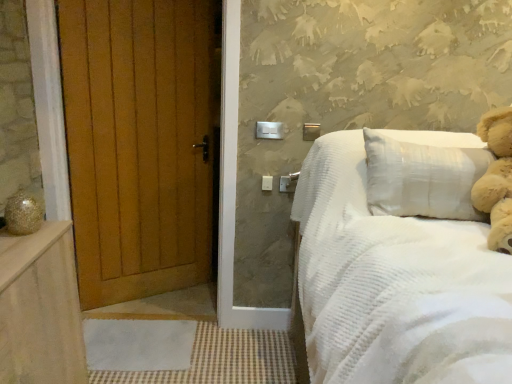
Identify the location of wooden balustrade at lower left. (40, 309).

The image size is (512, 384). I want to click on white corduroy bed at right, so click(394, 284).

Identify the location of wooden door at left. (139, 142).

From the image's perspective, is wooden door at left above or below white corduroy bed at right?

Based on their image positions, wooden door at left is located above white corduroy bed at right.

In the image, is wooden door at left positioned in front of or behind white corduroy bed at right?

In the image, wooden door at left appears behind white corduroy bed at right.

Based on the photo, considering the sizes of objects wooden door at left and white corduroy bed at right in the image provided, who is thinner, wooden door at left or white corduroy bed at right?

wooden door at left.

Are wooden door at left and white corduroy bed at right making contact?

wooden door at left and white corduroy bed at right are not in contact.

Considering the positions of objects white corduroy bed at right and fluffy beige teddy bear at upper right in the image provided, who is behind, white corduroy bed at right or fluffy beige teddy bear at upper right?

fluffy beige teddy bear at upper right is more distant.

Considering the points (332, 372) and (503, 123), which point is in front, point (332, 372) or point (503, 123)?

Point (332, 372)

From a real-world perspective, is white corduroy bed at right physically below fluffy beige teddy bear at upper right?

Yes.

From the image's perspective, between fluffy beige teddy bear at upper right and wooden door at left, who is located below?

wooden door at left.

Find the location of `teddy above the wooden door at left (from a real-world perspective)`. teddy above the wooden door at left (from a real-world perspective) is located at coordinates (496, 178).

Is fluffy beige teddy bear at upper right facing towards wooden door at left?

No, fluffy beige teddy bear at upper right is not aimed at wooden door at left.

In the scene shown: From a real-world perspective, is fluffy beige teddy bear at upper right positioned under wooden door at left based on gravity?

No, from a real-world perspective, fluffy beige teddy bear at upper right is not below wooden door at left.

Considering the relative sizes of white corduroy bed at right and wooden door at left in the image provided, is white corduroy bed at right bigger than wooden door at left?

Yes, white corduroy bed at right is bigger than wooden door at left.

Is white corduroy bed at right outside of wooden door at left?

Yes, white corduroy bed at right is not within wooden door at left.

From the image's perspective, is white corduroy bed at right on top of wooden door at left?

No.

Is white corduroy bed at right facing away from wooden door at left?

No, white corduroy bed at right is not facing the opposite direction of wooden door at left.

You are a GUI agent. You are given a task and a screenshot of the screen. Output one action in this format:
    pyautogui.click(x=<x>, y=<y>)
    Task: Click on the teddy above the white corduroy bed at right (from the image's perspective)
    
    Given the screenshot: What is the action you would take?
    pyautogui.click(x=496, y=178)

Which point is more forward, (510, 200) or (372, 303)?

The point (372, 303) is closer to the camera.

Who is taller, fluffy beige teddy bear at upper right or white corduroy bed at right?

white corduroy bed at right.

Can you confirm if fluffy beige teddy bear at upper right is thinner than white corduroy bed at right?

Correct, the width of fluffy beige teddy bear at upper right is less than that of white corduroy bed at right.

Is wooden balustrade at lower left placed right next to wooden door at left?

No, wooden balustrade at lower left is not touching wooden door at left.

Consider the image. In terms of size, does wooden balustrade at lower left appear bigger or smaller than wooden door at left?

wooden balustrade at lower left is bigger than wooden door at left.

Is wooden balustrade at lower left oriented towards wooden door at left?

No, wooden balustrade at lower left does not turn towards wooden door at left.

From the image's perspective, which is below, wooden balustrade at lower left or wooden door at left?

wooden balustrade at lower left.

Is point (8, 237) positioned behind point (458, 138)?

No.

Consider the image. From a real-world perspective, which is physically above, wooden balustrade at lower left or white corduroy bed at right?

From a 3D spatial view, white corduroy bed at right is above.

Can you confirm if wooden balustrade at lower left is positioned to the left of white corduroy bed at right?

Yes, wooden balustrade at lower left is to the left of white corduroy bed at right.

The height and width of the screenshot is (384, 512). I want to click on balustrade on the left of the white corduroy bed at right, so click(x=40, y=309).

The image size is (512, 384). What are the coordinates of `door above the white corduroy bed at right (from a real-world perspective)` in the screenshot? It's located at (139, 142).

You are a GUI agent. You are given a task and a screenshot of the screen. Output one action in this format:
    pyautogui.click(x=<x>, y=<y>)
    Task: Click on the bed below the fluffy beige teddy bear at upper right (from a real-world perspective)
    The height and width of the screenshot is (384, 512).
    Given the screenshot: What is the action you would take?
    pyautogui.click(x=394, y=284)

From the image, which object appears to be farther from wooden door at left, fluffy beige teddy bear at upper right or white corduroy bed at right?

Among the two, fluffy beige teddy bear at upper right is located further to wooden door at left.

From the picture: Based on their spatial positions, is fluffy beige teddy bear at upper right or white corduroy bed at right closer to wooden balustrade at lower left?

Among the two, white corduroy bed at right is located nearer to wooden balustrade at lower left.

Based on the photo, when comparing their distances from wooden balustrade at lower left, does fluffy beige teddy bear at upper right or wooden door at left seem closer?

Based on the image, wooden door at left appears to be nearer to wooden balustrade at lower left.

Looking at the image, which one is located further to fluffy beige teddy bear at upper right, wooden balustrade at lower left or white corduroy bed at right?

The object further to fluffy beige teddy bear at upper right is wooden balustrade at lower left.

From the image, which object appears to be farther from wooden balustrade at lower left, wooden door at left or fluffy beige teddy bear at upper right?

The object further to wooden balustrade at lower left is fluffy beige teddy bear at upper right.

When comparing their distances from wooden balustrade at lower left, does wooden door at left or white corduroy bed at right seem further?

wooden door at left lies further to wooden balustrade at lower left than the other object.

Which object lies nearer to the anchor point white corduroy bed at right, fluffy beige teddy bear at upper right or wooden door at left?

Among the two, fluffy beige teddy bear at upper right is located nearer to white corduroy bed at right.

When comparing their distances from wooden door at left, does wooden balustrade at lower left or fluffy beige teddy bear at upper right seem further?

fluffy beige teddy bear at upper right.

Locate an element on the screen. This screenshot has height=384, width=512. bed between wooden door at left and fluffy beige teddy bear at upper right from left to right is located at coordinates (394, 284).

The height and width of the screenshot is (384, 512). What are the coordinates of `door between wooden balustrade at lower left and white corduroy bed at right` in the screenshot? It's located at (139, 142).

Identify the location of door situated between wooden balustrade at lower left and fluffy beige teddy bear at upper right from left to right. (139, 142).

Where is `bed situated between wooden balustrade at lower left and fluffy beige teddy bear at upper right from left to right`? The image size is (512, 384). bed situated between wooden balustrade at lower left and fluffy beige teddy bear at upper right from left to right is located at coordinates (394, 284).